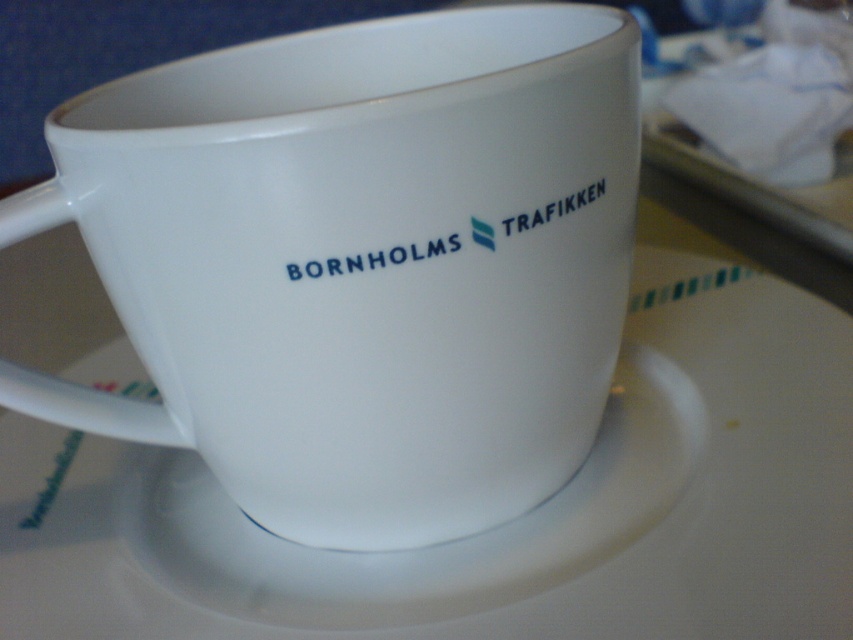
Does point (479, 220) come farther from viewer compared to point (321, 273)?

Yes, it is behind point (321, 273).

Does blue matte logo at center appear under white matte text at center?

Incorrect, blue matte logo at center is not positioned below white matte text at center.

Is point (451, 250) less distant than point (440, 252)?

No, it is behind (440, 252).

Locate an element on the screen. This screenshot has height=640, width=853. blue matte logo at center is located at coordinates (376, 257).

Who is more forward, (379,275) or (851,401)?

Point (379,275)

Find the location of `white ceramic mug at center`. white ceramic mug at center is located at coordinates (358, 272).

Does point (531, 220) come farther from viewer compared to point (550, 216)?

That is False.

Can you confirm if blue matte logo at center is bigger than white matte text at upper right?

Correct, blue matte logo at center is larger in size than white matte text at upper right.

This screenshot has width=853, height=640. What do you see at coordinates (376, 257) in the screenshot? I see `blue matte logo at center` at bounding box center [376, 257].

At what (x,y) coordinates should I click in order to perform the action: click on blue matte logo at center. Please return your answer as a coordinate pair (x, y). Image resolution: width=853 pixels, height=640 pixels. Looking at the image, I should click on [376, 257].